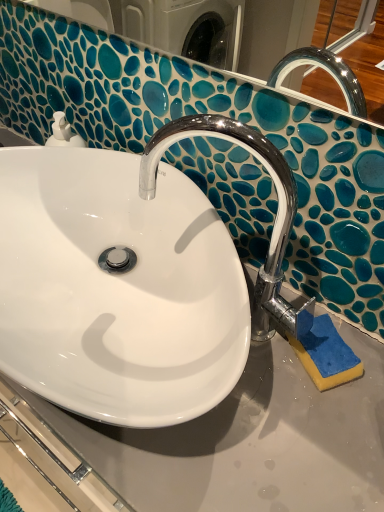
What do you see at coordinates (274, 222) in the screenshot?
I see `chrome/metallic faucet at center` at bounding box center [274, 222].

Identify the location of white glossy sink at center. The image size is (384, 512). (133, 279).

Looking at this image, is blue sponge at lower right positioned before chrome/metallic faucet at center?

No, it is not.

From the image's perspective, is blue sponge at lower right located above or below chrome/metallic faucet at center?

Clearly, from the image's perspective, blue sponge at lower right is below chrome/metallic faucet at center.

Is blue sponge at lower right inside the boundaries of chrome/metallic faucet at center, or outside?

The correct answer is: outside.

Considering the positions of objects blue sponge at lower right and chrome/metallic faucet at center in the image provided, who is more to the left, blue sponge at lower right or chrome/metallic faucet at center?

chrome/metallic faucet at center.

Is blue sponge at lower right positioned with its back to white glossy sink at center?

No, blue sponge at lower right is not facing the opposite direction of white glossy sink at center.

Consider the image. Looking at their sizes, would you say blue sponge at lower right is wider or thinner than white glossy sink at center?

Considering their sizes, blue sponge at lower right looks slimmer than white glossy sink at center.

Is white glossy sink at center completely or partially inside blue sponge at lower right?

No.

Which object is more forward, chrome/metallic faucet at center or blue sponge at lower right?

Positioned in front is chrome/metallic faucet at center.

From the image's perspective, relative to blue sponge at lower right, is chrome/metallic faucet at center above or below?

chrome/metallic faucet at center is above blue sponge at lower right.

Consider the image. Are chrome/metallic faucet at center and blue sponge at lower right beside each other?

chrome/metallic faucet at center and blue sponge at lower right are clearly separated.

Between chrome/metallic faucet at center and white glossy sink at center, which one appears on the left side from the viewer's perspective?

From the viewer's perspective, white glossy sink at center appears more on the left side.

Can you tell me how much chrome/metallic faucet at center and white glossy sink at center differ in facing direction?

71.7 degrees.

From a real-world perspective, between chrome/metallic faucet at center and white glossy sink at center, who is vertically lower?

white glossy sink at center.

In the scene shown: Is white glossy sink at center at the right side of blue sponge at lower right?

Incorrect, white glossy sink at center is not on the right side of blue sponge at lower right.

Which object is wider, white glossy sink at center or blue sponge at lower right?

white glossy sink at center.

Is white glossy sink at center positioned beyond the bounds of blue sponge at lower right?

white glossy sink at center is positioned outside blue sponge at lower right.

Find the location of `sink located above the blue sponge at lower right (from a real-world perspective)`. sink located above the blue sponge at lower right (from a real-world perspective) is located at coordinates (133, 279).

How much distance is there between white glossy sink at center and chrome/metallic faucet at center?

A distance of 10.22 centimeters exists between white glossy sink at center and chrome/metallic faucet at center.

Is white glossy sink at center at the right side of chrome/metallic faucet at center?

In fact, white glossy sink at center is to the left of chrome/metallic faucet at center.

Is white glossy sink at center next to chrome/metallic faucet at center and touching it?

There is a gap between white glossy sink at center and chrome/metallic faucet at center.

Based on the photo, from a real-world perspective, which is physically above, white glossy sink at center or chrome/metallic faucet at center?

chrome/metallic faucet at center.

You are a GUI agent. You are given a task and a screenshot of the screen. Output one action in this format:
    pyautogui.click(x=<x>, y=<y>)
    Task: Click on the tap located on the left of blue sponge at lower right
    
    Given the screenshot: What is the action you would take?
    pyautogui.click(x=274, y=222)

Find the location of a particular element. This screenshot has height=512, width=384. sink above the blue sponge at lower right (from a real-world perspective) is located at coordinates (133, 279).

From the image, which object appears to be farther from chrome/metallic faucet at center, white glossy sink at center or blue sponge at lower right?

Among the two, blue sponge at lower right is located further to chrome/metallic faucet at center.

Looking at the image, which one is located closer to blue sponge at lower right, white glossy sink at center or chrome/metallic faucet at center?

chrome/metallic faucet at center is closer to blue sponge at lower right.

Which object lies further to the anchor point blue sponge at lower right, chrome/metallic faucet at center or white glossy sink at center?

Based on the image, white glossy sink at center appears to be further to blue sponge at lower right.

Looking at the image, which one is located further to white glossy sink at center, blue sponge at lower right or chrome/metallic faucet at center?

blue sponge at lower right is further to white glossy sink at center.

Considering their positions, is chrome/metallic faucet at center positioned further to white glossy sink at center than blue sponge at lower right?

Based on the image, blue sponge at lower right appears to be further to white glossy sink at center.

Which object lies nearer to the anchor point chrome/metallic faucet at center, blue sponge at lower right or white glossy sink at center?

white glossy sink at center.

This screenshot has width=384, height=512. I want to click on tap between white glossy sink at center and blue sponge at lower right from left to right, so click(x=274, y=222).